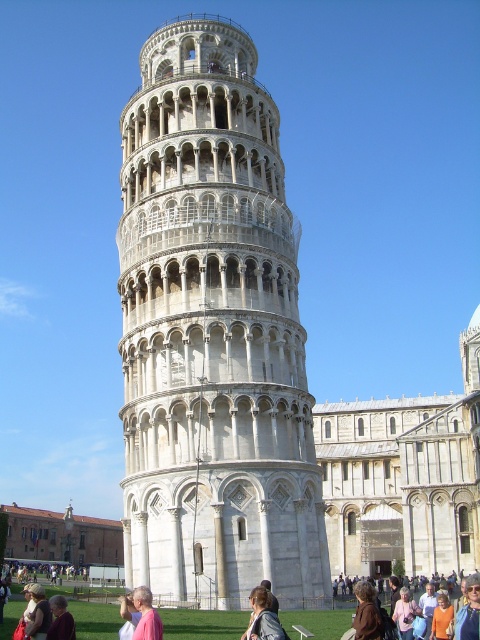
Question: Does white stone tower at center have a smaller size compared to leather jacket at lower center?

Choices:
 (A) no
 (B) yes

Answer: (A)

Question: Which object appears farthest from the camera in this image?

Choices:
 (A) white stone tower at center
 (B) light brown hair at lower left
 (C) brown leather jacket at lower center
 (D) leather jacket at lower center

Answer: (A)

Question: Does white stone tower at center appear on the right side of leather jacket at lower center?

Choices:
 (A) no
 (B) yes

Answer: (A)

Question: Which of these objects is positioned farthest from the light brown hair at lower left?

Choices:
 (A) brown leather jacket at lower center
 (B) white stone tower at center
 (C) leather jacket at lower center

Answer: (B)

Question: Which object is closer to the camera taking this photo?

Choices:
 (A) brown leather jacket at lower center
 (B) light brown hair at lower left
 (C) white stone tower at center

Answer: (A)

Question: Does leather jacket at lower center have a larger size compared to light brown hair at lower left?

Choices:
 (A) no
 (B) yes

Answer: (A)